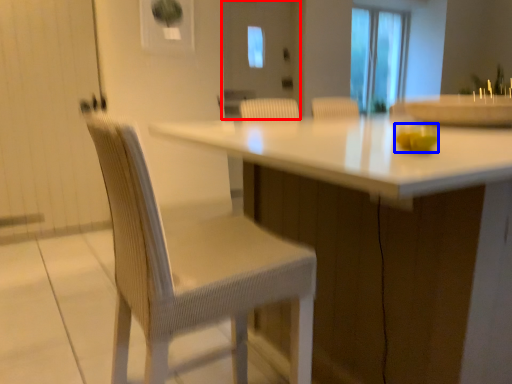
Question: Which point is further to the camera, screen door (highlighted by a red box) or food (highlighted by a blue box)?

Choices:
 (A) screen door
 (B) food

Answer: (A)